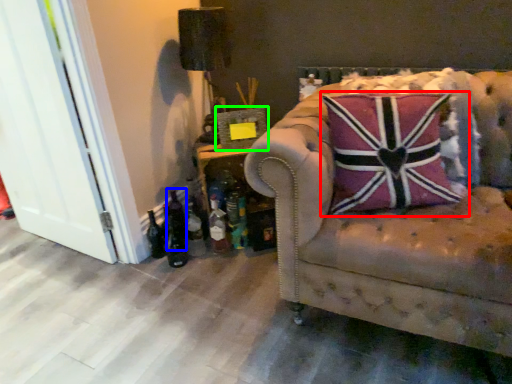
Question: Estimate the real-world distances between objects in this image. Which object is farther from pillow (highlighted by a red box), beer bottle (highlighted by a blue box) or picture frame (highlighted by a green box)?

Choices:
 (A) beer bottle
 (B) picture frame

Answer: (A)